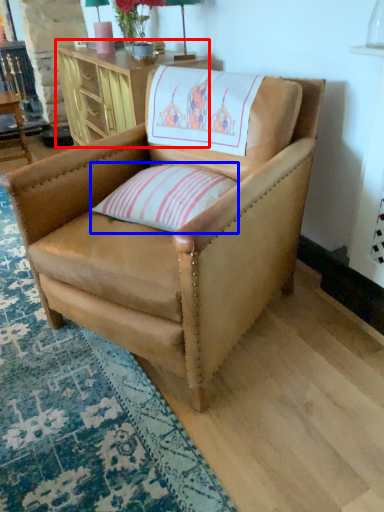
Question: Which point is closer to the camera, table (highlighted by a red box) or pillow (highlighted by a blue box)?

Choices:
 (A) table
 (B) pillow

Answer: (B)